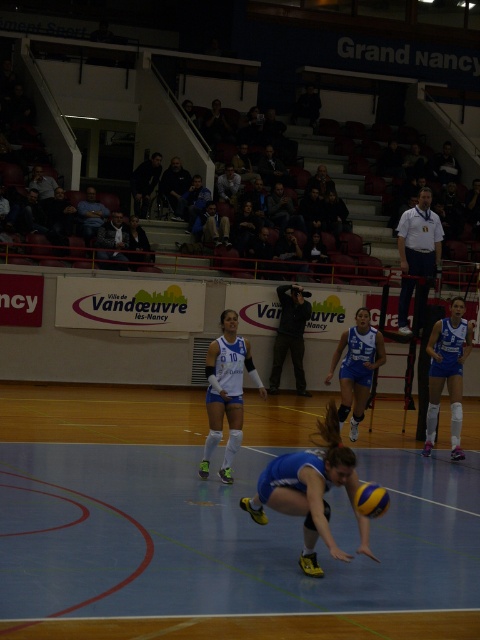
Question: Considering the real-world distances, which object is closest to the blue fabric volleyball at center?

Choices:
 (A) blue jersey at right
 (B) yellow matte/vinyl volleyball at center

Answer: (B)

Question: Does blue fabric volleyball at center appear over blue jersey at right?

Choices:
 (A) yes
 (B) no

Answer: (B)

Question: Is blue fabric volleyball at center bigger than yellow matte/vinyl volleyball at center?

Choices:
 (A) yes
 (B) no

Answer: (A)

Question: Is the position of blue matte volleyball player at center more distant than that of yellow matte/vinyl volleyball at center?

Choices:
 (A) no
 (B) yes

Answer: (B)

Question: Estimate the real-world distances between objects in this image. Which object is closer to the blue matte volleyball player at center?

Choices:
 (A) blue jersey at right
 (B) yellow matte/vinyl volleyball at center
 (C) blue fabric volleyball at center
 (D) white matte uniform at center

Answer: (A)

Question: Which object is closer to the camera taking this photo?

Choices:
 (A) white matte uniform at center
 (B) blue fabric volleyball at center
 (C) yellow matte/vinyl volleyball at center

Answer: (B)